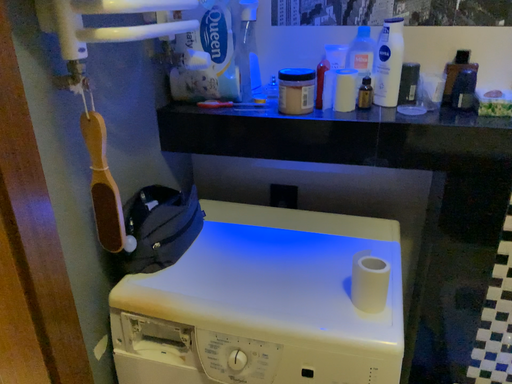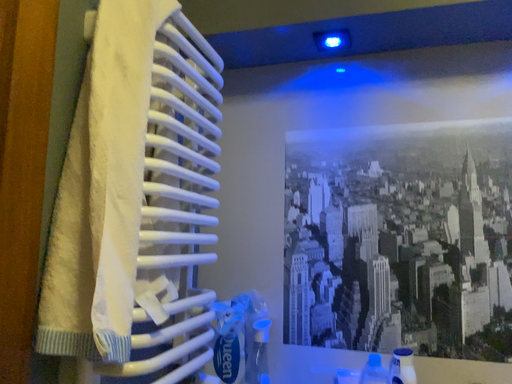
Question: How did the camera likely rotate when shooting the video?

Choices:
 (A) rotated upward
 (B) rotated downward

Answer: (A)